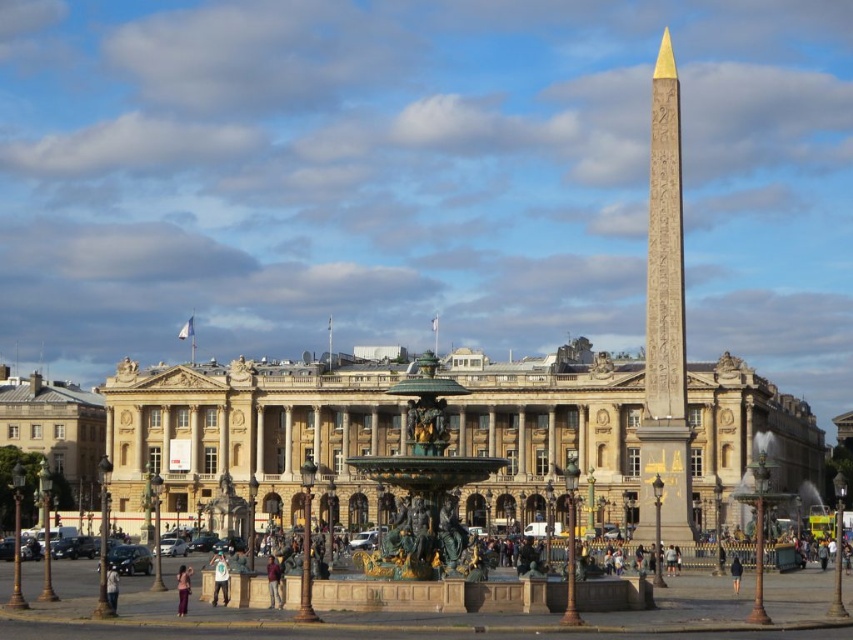
Question: Based on their relative distances, which object is farther from the white cotton shirt at center?

Choices:
 (A) brown leather jacket at center
 (B) gold polished stone obelisk at center
 (C) denim pants at lower center
 (D) light blue denim jacket at lower center

Answer: (B)

Question: Among these points, which one is nearest to the camera?

Choices:
 (A) (277, 604)
 (B) (735, 582)

Answer: (A)

Question: Which object is the farthest from the matte gray building at left?

Choices:
 (A) black leather jacket at lower right
 (B) white cotton shirt at center
 (C) bronze/golden statue at center

Answer: (A)

Question: Does bronze/golden statue at center have a smaller size compared to light blue denim jacket at lower center?

Choices:
 (A) no
 (B) yes

Answer: (A)

Question: Can you confirm if golden stone palace at center is bigger than brown leather jacket at center?

Choices:
 (A) yes
 (B) no

Answer: (A)

Question: Does bronze/golden statue at center appear under light blue denim jacket at lower center?

Choices:
 (A) yes
 (B) no

Answer: (B)